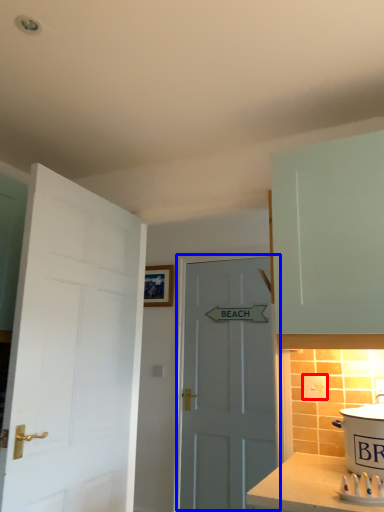
Question: Among these objects, which one is nearest to the camera, electric outlet (highlighted by a red box) or door (highlighted by a blue box)?

Choices:
 (A) electric outlet
 (B) door

Answer: (A)